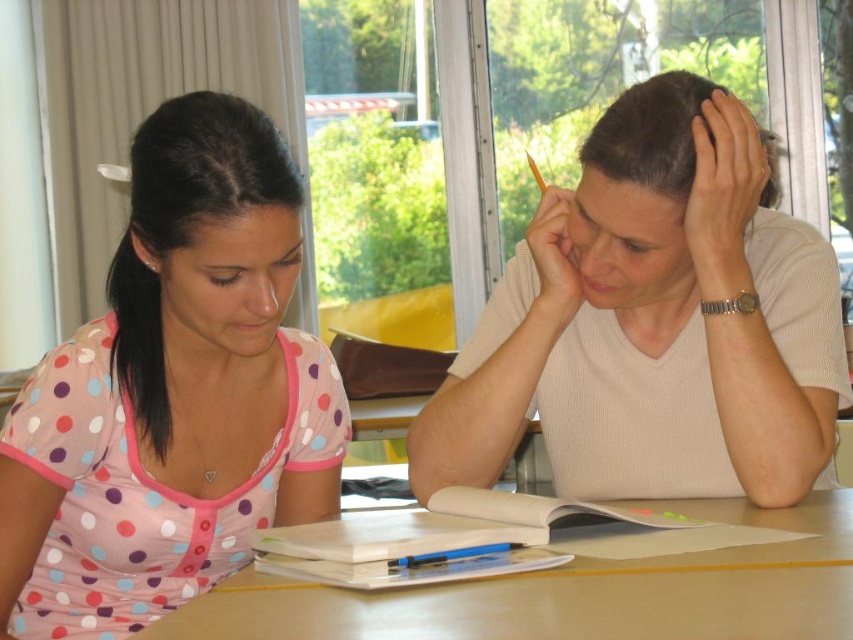
Can you confirm if white matte shirt at upper right is bigger than matte white hair at upper right?

Correct, white matte shirt at upper right is larger in size than matte white hair at upper right.

Is point (728, 492) closer to viewer compared to point (647, 156)?

That is False.

Locate an element on the screen. This screenshot has width=853, height=640. white matte shirt at upper right is located at coordinates (654, 326).

At what (x,y) coordinates should I click in order to perform the action: click on pink dotted shirt at left. Please return your answer as a coordinate pair (x, y). Looking at the image, I should click on (189, 202).

Which of these two, pink dotted shirt at left or matte skin forehead at center, stands taller?

pink dotted shirt at left

Image resolution: width=853 pixels, height=640 pixels. I want to click on pink dotted shirt at left, so click(189, 202).

The width and height of the screenshot is (853, 640). I want to click on pink dotted shirt at left, so click(x=189, y=202).

Is point (680, 148) closer to camera compared to point (676, 220)?

Yes.

The height and width of the screenshot is (640, 853). Describe the element at coordinates (650, 132) in the screenshot. I see `matte white hair at upper right` at that location.

Is point (761, 195) farther from viewer compared to point (601, 202)?

Yes, it is behind point (601, 202).

Identify the location of matte white hair at upper right. (650, 132).